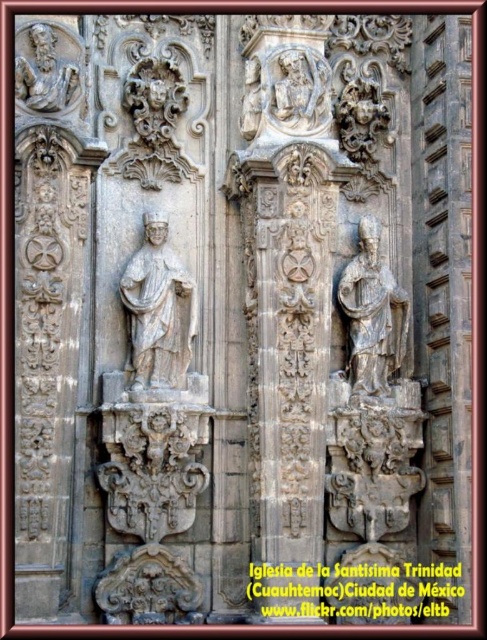
Question: Can you confirm if white stone statue at center is positioned above gray stone statue at upper left?

Choices:
 (A) no
 (B) yes

Answer: (A)

Question: Which object is the closest to the white stone statue at center?

Choices:
 (A) gray stone statue at center
 (B) gray stone statue at upper left

Answer: (A)

Question: Which point is closer to the camera taking this photo?

Choices:
 (A) (51, 81)
 (B) (179, 264)
 (C) (384, 372)

Answer: (A)

Question: Can you confirm if white stone statue at center is bigger than gray stone statue at center?

Choices:
 (A) yes
 (B) no

Answer: (B)

Question: From the image, what is the correct spatial relationship of gray stone statue at center in relation to gray stone statue at upper left?

Choices:
 (A) right
 (B) left

Answer: (A)

Question: Based on their relative distances, which object is farther from the white stone statue at center?

Choices:
 (A) gray stone statue at upper left
 (B) gray stone statue at center

Answer: (A)